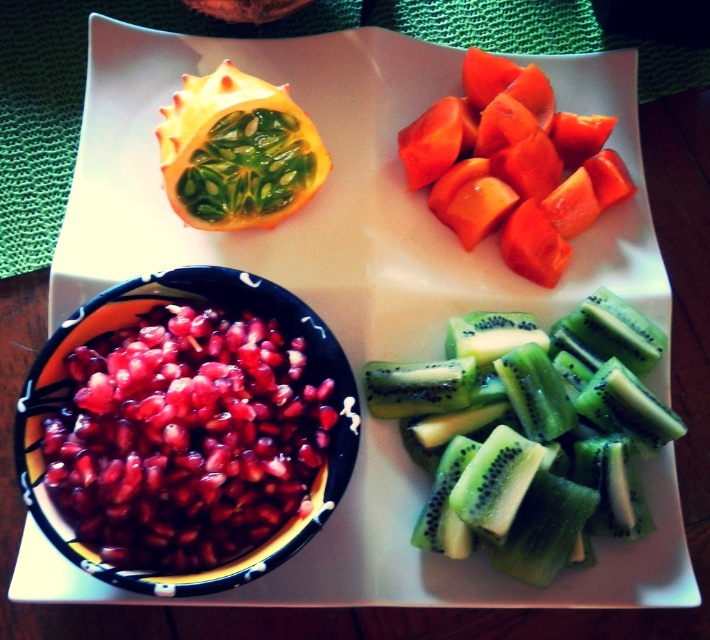
Question: Considering the relative positions of pomegranate seeds at center and green matte passion fruit at upper left in the image provided, where is pomegranate seeds at center located with respect to green matte passion fruit at upper left?

Choices:
 (A) above
 (B) below

Answer: (B)

Question: Is pomegranate seeds at center in front of bright orange flesh at upper right?

Choices:
 (A) no
 (B) yes

Answer: (B)

Question: Estimate the real-world distances between objects in this image. Which object is closer to the bright orange flesh at upper right?

Choices:
 (A) green fleshed kiwi at center
 (B) pomegranate seeds at center

Answer: (A)

Question: Which is nearer to the green fleshed kiwi at center?

Choices:
 (A) pomegranate seeds at center
 (B) green matte passion fruit at upper left

Answer: (A)

Question: Is green fleshed kiwi at center below bright orange flesh at upper right?

Choices:
 (A) no
 (B) yes

Answer: (B)

Question: Which point is closer to the camera taking this photo?

Choices:
 (A) (136, 564)
 (B) (501, 371)

Answer: (A)